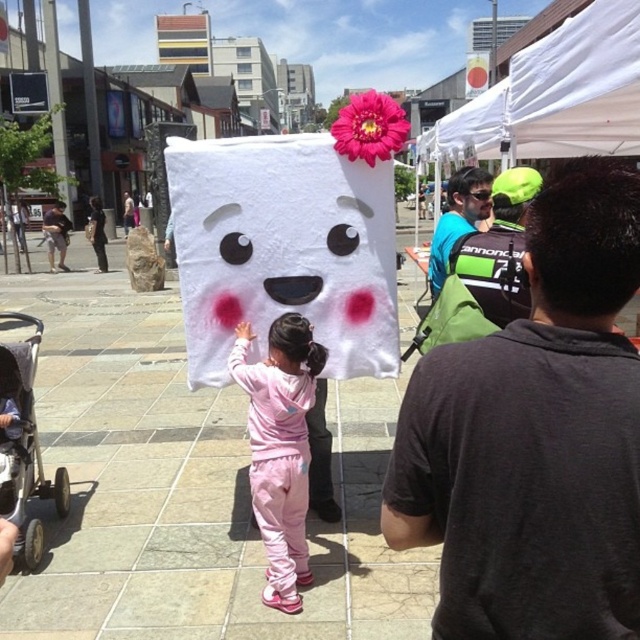
You are standing in the plaza and want to pick up the blue fabric backpack at upper right and the light brown leather jacket at left. Which item should you reach for first to grab the closest one?

The blue fabric backpack at upper right is closer to the viewer than the light brown leather jacket at left, so you should reach for the blue fabric backpack at upper right first.

You are a parent at the event and need to decide whether to put your 18 month old child into the gray fabric stroller at lower left or wear the light brown leather jacket at left. Based on their sizes, which item would be more appropriate for a child of that age?

The gray fabric stroller at lower left is smaller than the light brown leather jacket at left, so the gray fabric stroller at lower left would be more appropriate for an 18 month old child.